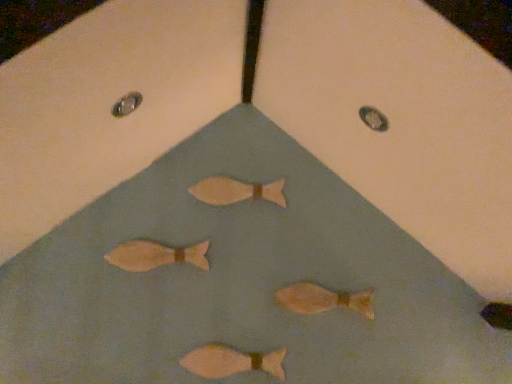
Question: Considering the positions of matte brown fish at center, the third fish positioned from the bottom, and matte wooden fish at center, positioned as the first fish in top-to-bottom order, in the image, is matte brown fish at center, the third fish positioned from the bottom, taller or shorter than matte wooden fish at center, positioned as the first fish in top-to-bottom order,?

Choices:
 (A) tall
 (B) short

Answer: (A)

Question: Considering the relative positions of matte brown fish at center, the 2th fish viewed from the top, and matte wooden fish at center, positioned as the first fish in top-to-bottom order, in the image provided, is matte brown fish at center, the 2th fish viewed from the top, to the left or to the right of matte wooden fish at center, positioned as the first fish in top-to-bottom order,?

Choices:
 (A) left
 (B) right

Answer: (A)

Question: Based on their relative distances, which object is nearer to the matte pink fish at center, marked as the fourth fish in a top-to-bottom arrangement?

Choices:
 (A) matte orange fish at center, the second fish ordered from the bottom
 (B) matte brown fish at center, the 2th fish viewed from the top
 (C) matte wooden fish at center, positioned as the first fish in top-to-bottom order

Answer: (A)

Question: Which object is positioned farthest from the matte brown fish at center, the third fish positioned from the bottom?

Choices:
 (A) matte wooden fish at center, positioned as the fourth fish in bottom-to-top order
 (B) matte orange fish at center, the second fish ordered from the bottom
 (C) matte pink fish at center, marked as the fourth fish in a top-to-bottom arrangement

Answer: (B)